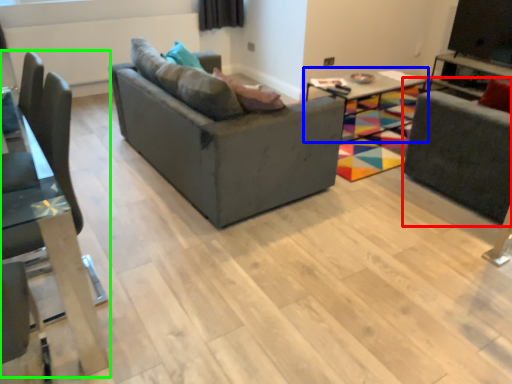
Question: Based on their relative distances, which object is farther from swivel chair (highlighted by a red box)? Choose from table (highlighted by a blue box) and chair (highlighted by a green box).

Choices:
 (A) table
 (B) chair

Answer: (B)